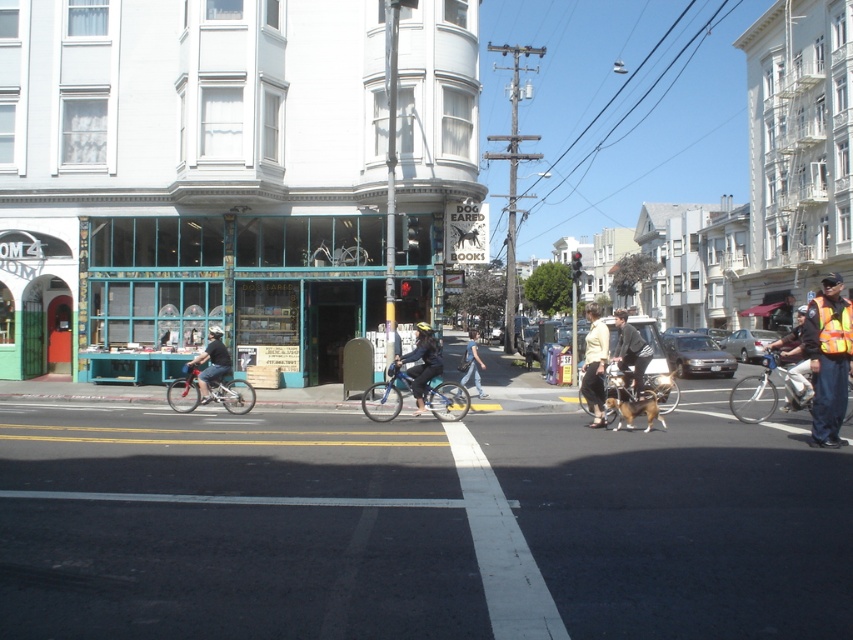
Question: Which is farther from the matte black bicycle at left?

Choices:
 (A) reflective silver helmet at center
 (B) blue matte bicycle at center
 (C) denim pants at center

Answer: (A)

Question: Does blue matte bicycle at center appear over dark blue fabric jacket at center?

Choices:
 (A) no
 (B) yes

Answer: (A)

Question: Does metallic blue bicycle at center appear on the left side of matte black bicycle at left?

Choices:
 (A) yes
 (B) no

Answer: (B)

Question: Does metallic bicycle at center have a lesser width compared to dark blue fabric jacket at center?

Choices:
 (A) yes
 (B) no

Answer: (B)

Question: Estimate the real-world distances between objects in this image. Which object is farther from the matte black sedan at center?

Choices:
 (A) black leather jacket at center
 (B) silver metallic bicycle at center-left
 (C) silver metallic bicycle at right
 (D) reflective silver helmet at center

Answer: (B)

Question: Which point appears farthest from the camera in this image?

Choices:
 (A) (614, 388)
 (B) (213, 468)
 (C) (712, 355)
 (D) (848, 305)

Answer: (C)